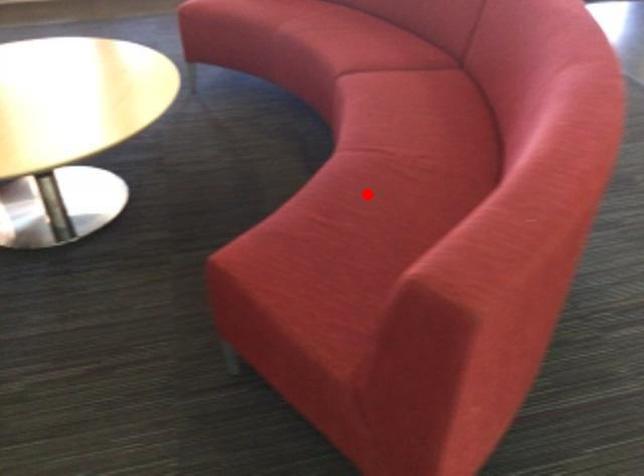
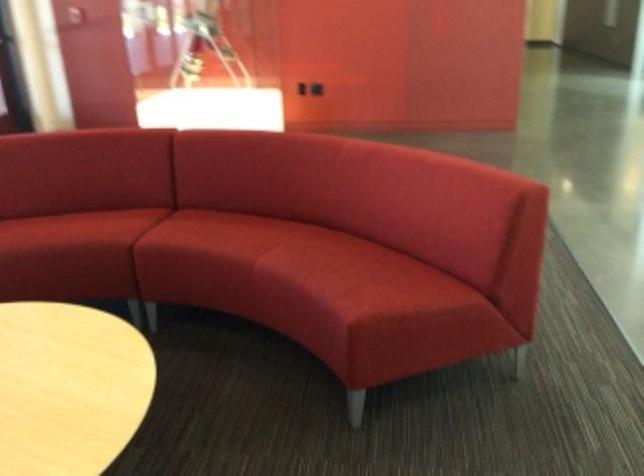
Question: I am providing you with two images of the same scene from different viewpoints. In image1, a red point is highlighted. Considering the same 3D point in image2, which of the following is correct?

Choices:
 (A) It is closer
 (B) It is farther

Answer: (B)